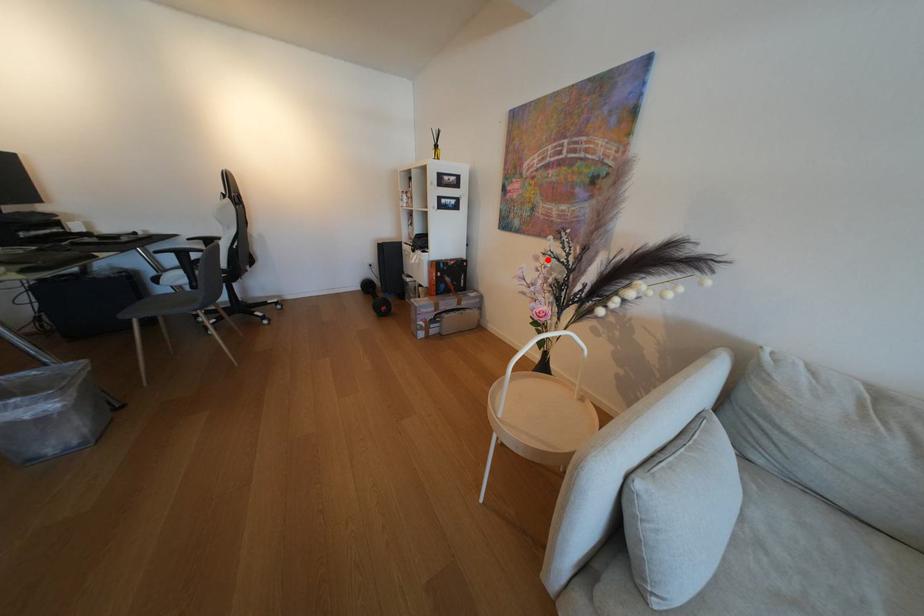
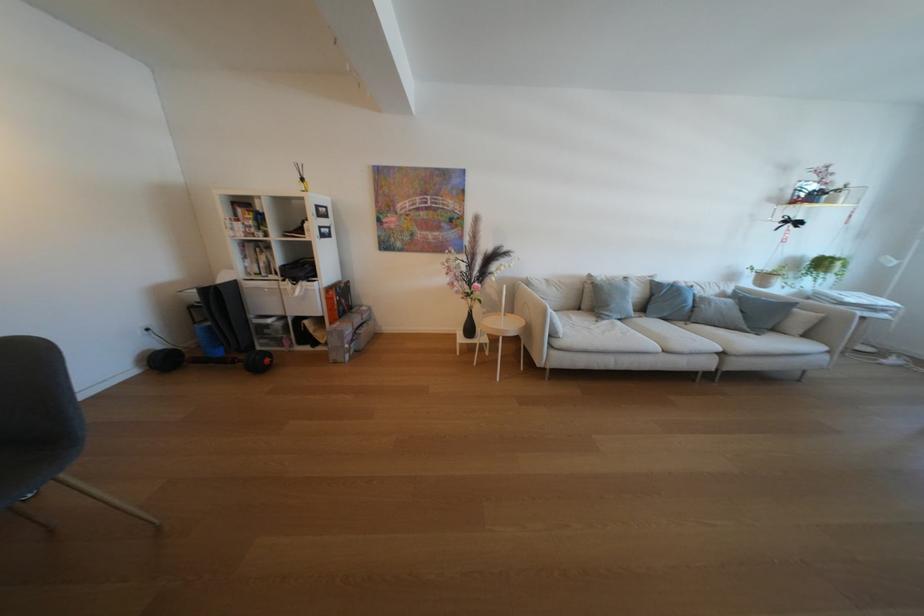
In the second image, find the point that corresponds to the highlighted location in the first image.

(455, 265)